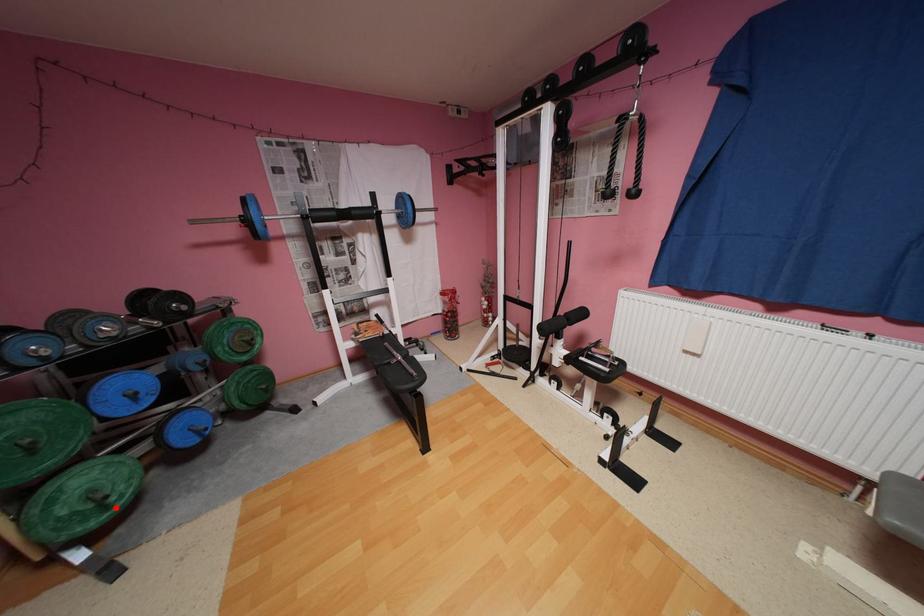
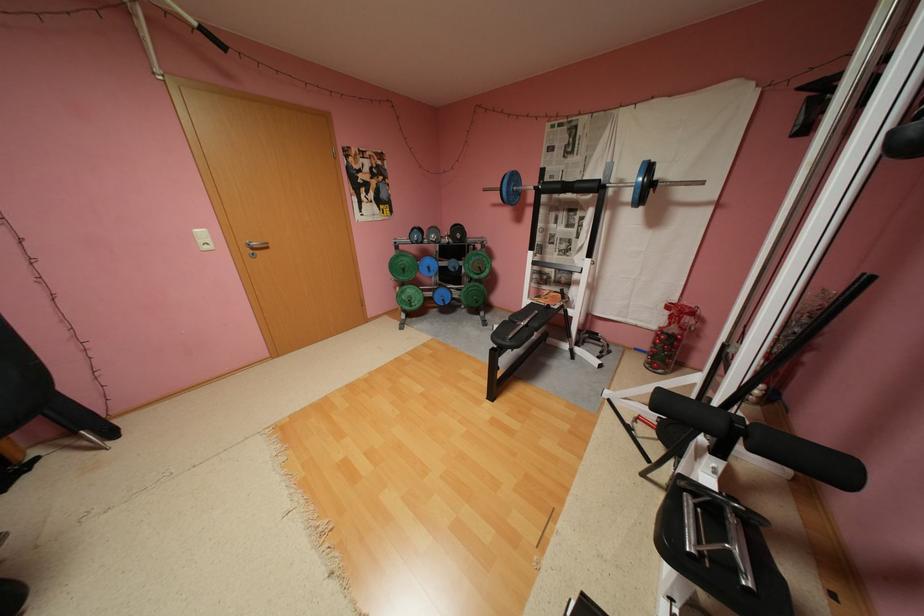
In the second image, find the point that corresponds to the highlighted location in the first image.

(419, 306)